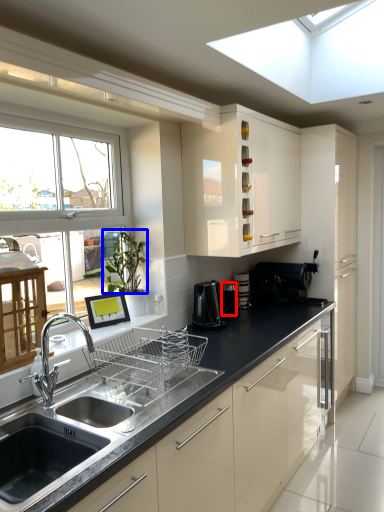
Question: Which object appears closest to the camera in this image, appliance (highlighted by a red box) or plant (highlighted by a blue box)?

Choices:
 (A) appliance
 (B) plant

Answer: (B)